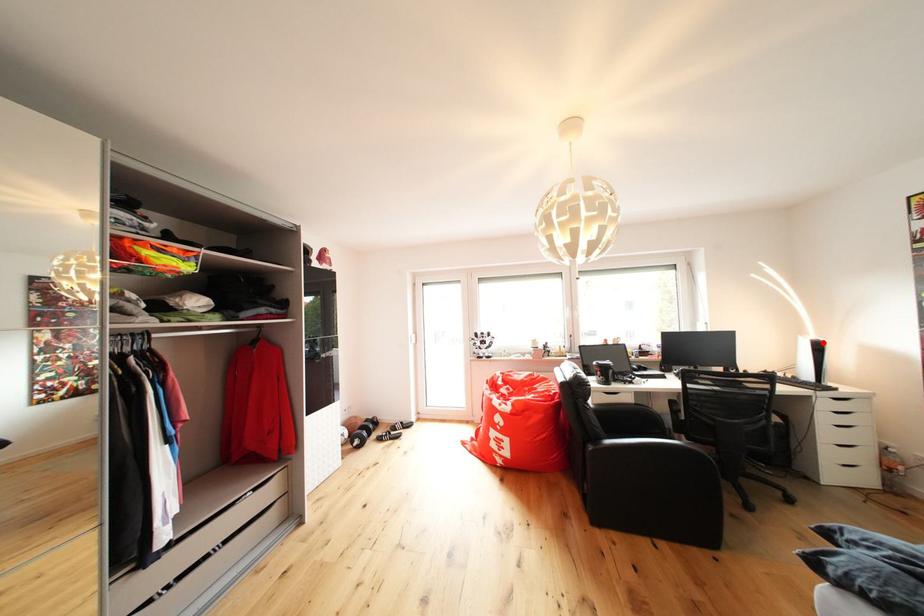
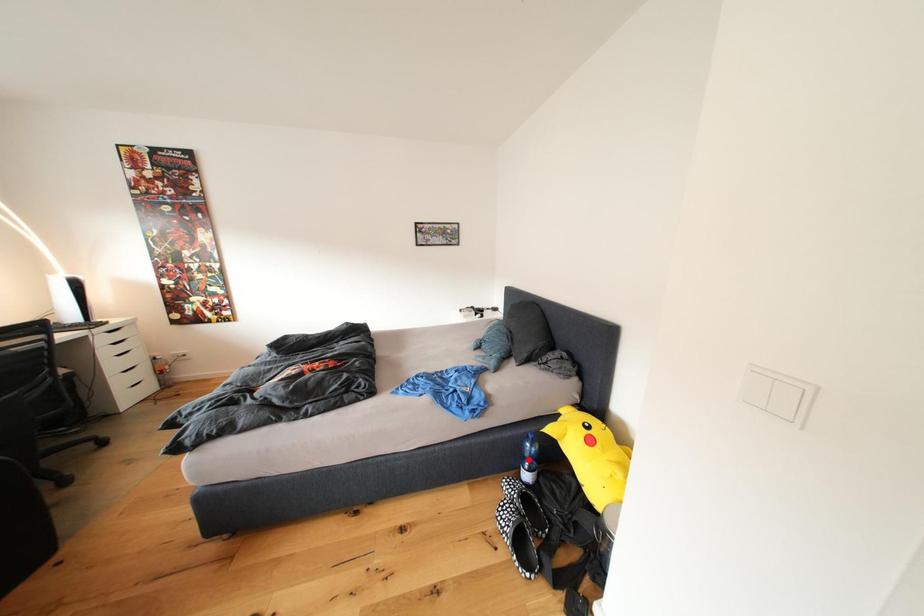
I am providing you with two images of the same scene from different viewpoints. A red point is marked on the first image and another point is marked on the second image. Does the point marked in image1 correspond to the same location as the one in image2?

No